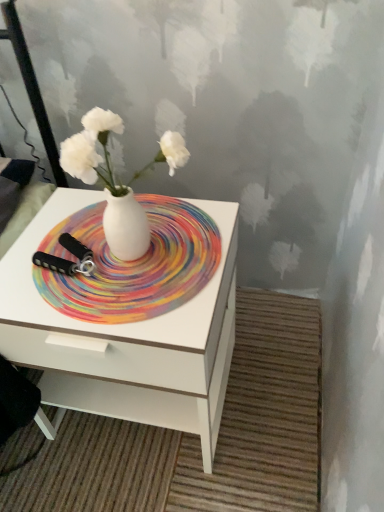
The height and width of the screenshot is (512, 384). I want to click on vacant area that lies to the right of white glossy vase at center, so click(x=208, y=243).